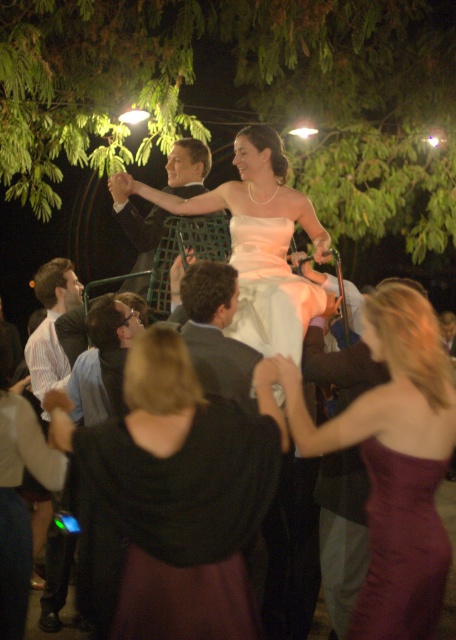
Can you confirm if black satin dress at center is positioned above striped cotton shirt at left?

Actually, black satin dress at center is below striped cotton shirt at left.

Who is taller, black satin dress at center or striped cotton shirt at left?

Standing taller between the two is black satin dress at center.

At what (x,y) coordinates should I click in order to perform the action: click on black satin dress at center. Please return your answer as a coordinate pair (x, y). This screenshot has width=456, height=640. Looking at the image, I should click on (184, 492).

Locate an element on the screen. The height and width of the screenshot is (640, 456). black satin dress at center is located at coordinates (184, 492).

Can you confirm if black satin dress at center is taller than burgundy satin dress at lower right?

Correct, black satin dress at center is much taller as burgundy satin dress at lower right.

Who is higher up, black satin dress at center or burgundy satin dress at lower right?

black satin dress at center is above.

Between point (243, 493) and point (431, 536), which one is positioned in front?

Point (431, 536)

You are a GUI agent. You are given a task and a screenshot of the screen. Output one action in this format:
    pyautogui.click(x=<x>, y=<y>)
    Task: Click on the black satin dress at center
    Image resolution: width=456 pixels, height=640 pixels.
    Given the screenshot: What is the action you would take?
    pyautogui.click(x=184, y=492)

Does point (414, 301) come closer to viewer compared to point (383, 592)?

No, (414, 301) is further to viewer.

Locate an element on the screen. shiny burgundy dress at center is located at coordinates (393, 461).